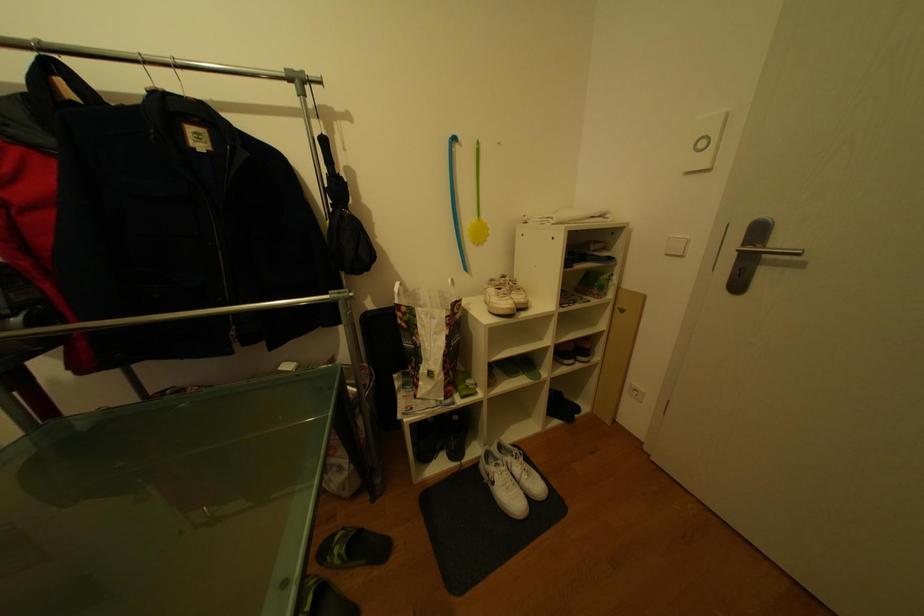
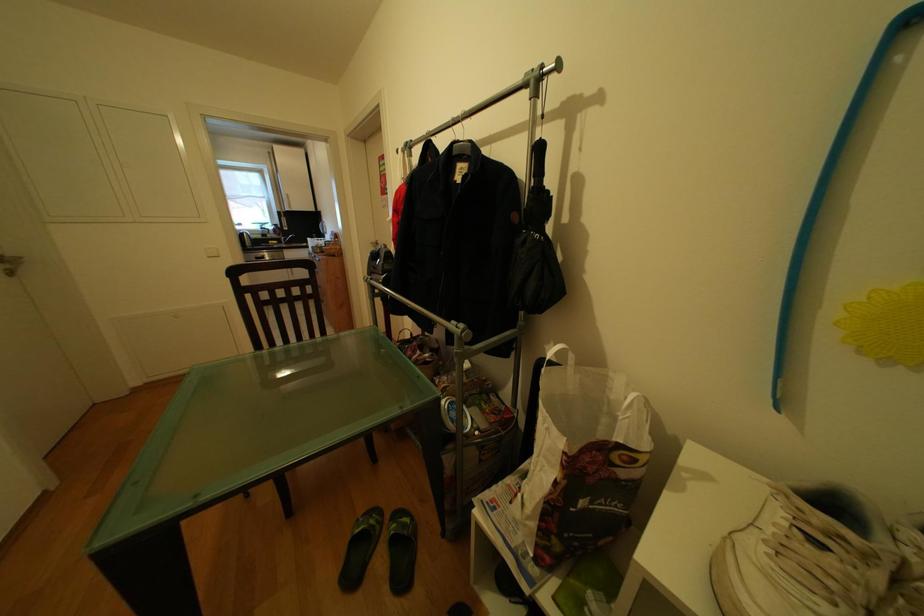
Question: The camera is either moving clockwise (left) or counter-clockwise (right) around the object. The first image is from the beginning of the video and the second image is from the end. Is the camera moving left or right when shooting the video?

Choices:
 (A) Left
 (B) Right

Answer: (B)